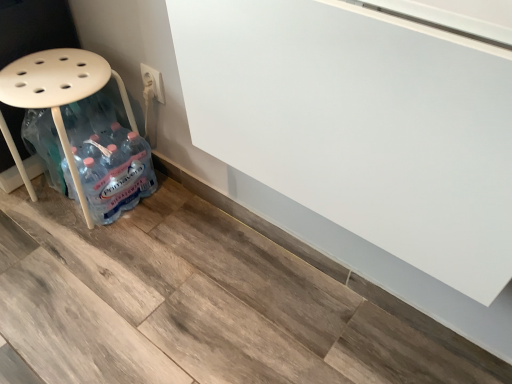
Question: Relative to white plastic electric outlet at upper center, is white plastic stool at left in front or behind?

Choices:
 (A) front
 (B) behind

Answer: (A)

Question: Looking at their shapes, would you say white plastic stool at left is wider or thinner than white plastic electric outlet at upper center?

Choices:
 (A) thin
 (B) wide

Answer: (B)

Question: From a real-world perspective, is white plastic stool at left above or below white plastic electric outlet at upper center?

Choices:
 (A) above
 (B) below

Answer: (B)

Question: Considering their positions, is white plastic electric outlet at upper center located in front of or behind white plastic stool at left?

Choices:
 (A) front
 (B) behind

Answer: (B)

Question: Considering the positions of point (142, 71) and point (92, 170), is point (142, 71) closer or farther from the camera than point (92, 170)?

Choices:
 (A) farther
 (B) closer

Answer: (A)

Question: From the image's perspective, is white plastic electric outlet at upper center positioned above or below white plastic stool at left?

Choices:
 (A) below
 (B) above

Answer: (B)

Question: Is white plastic electric outlet at upper center bigger or smaller than white plastic stool at left?

Choices:
 (A) big
 (B) small

Answer: (B)